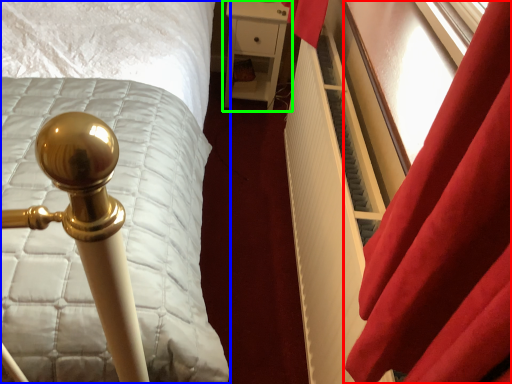
Question: Which object is the closest to the curtain (highlighted by a red box)? Choose among these: bed (highlighted by a blue box) or furniture (highlighted by a green box).

Choices:
 (A) bed
 (B) furniture

Answer: (A)